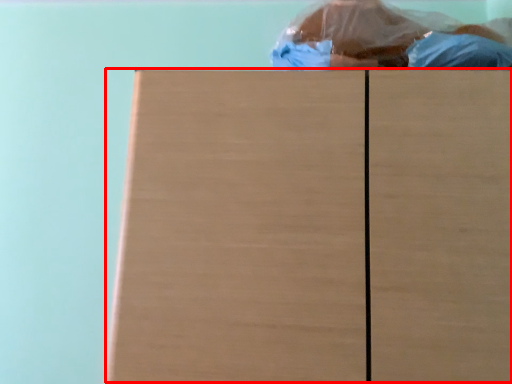
Question: Where is wood (annotated by the red box) located in relation to person in the image?

Choices:
 (A) left
 (B) right

Answer: (A)